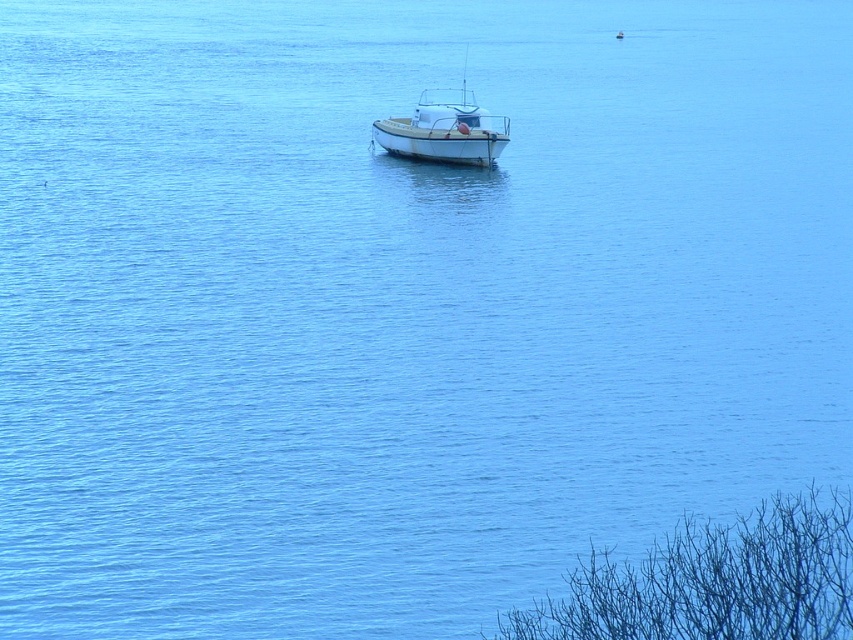
You are standing at the center of the boat and want to look at two points in the image. Which point, point (x=769, y=593) or point (x=503, y=132), is closer to you?

Point (x=769, y=593) is closer to the viewer than point (x=503, y=132).

You are standing on the dock and want to reach the bare branches at lower right. The dock is 10 meters long. Can you reach the branches without leaving the dock?

The distance between you and the bare branches at lower right is 11.36 meters, but the dock is only 10 meters long. Therefore, you cannot reach the branches without leaving the dock.